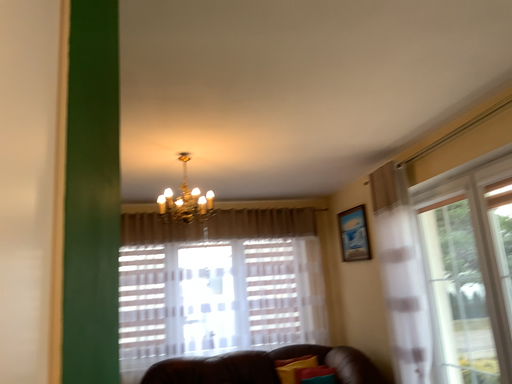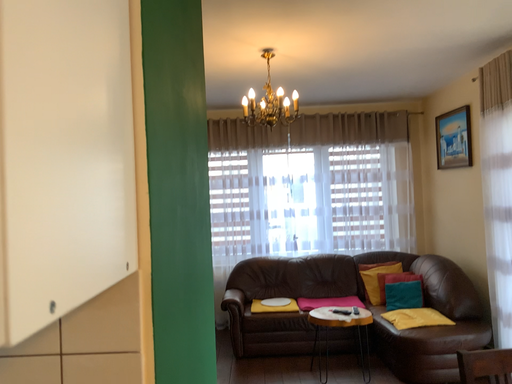
Question: How did the camera likely rotate when shooting the video?

Choices:
 (A) rotated upward
 (B) rotated downward

Answer: (B)